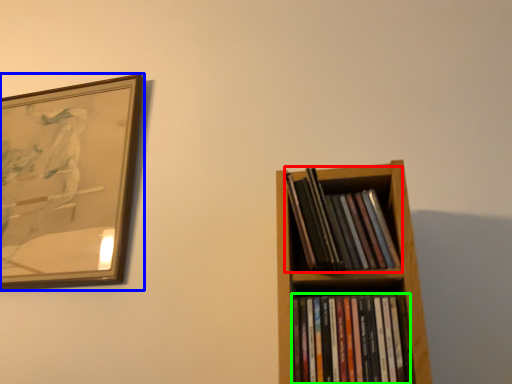
Question: Which object is the closest to the book (highlighted by a red box)? Choose among these: picture frame (highlighted by a blue box) or book (highlighted by a green box).

Choices:
 (A) picture frame
 (B) book

Answer: (B)